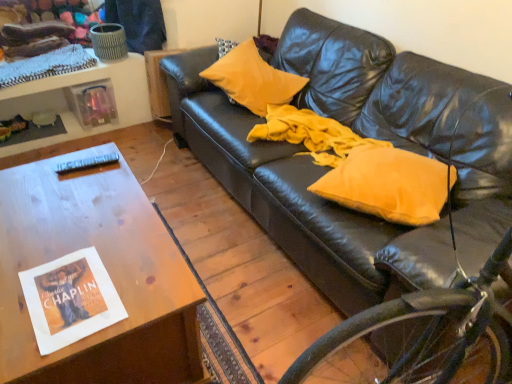
The height and width of the screenshot is (384, 512). Find the location of `empty space that is ontop of woodenwoodentable at left (from a real-world perspective)`. empty space that is ontop of woodenwoodentable at left (from a real-world perspective) is located at coordinates (76, 241).